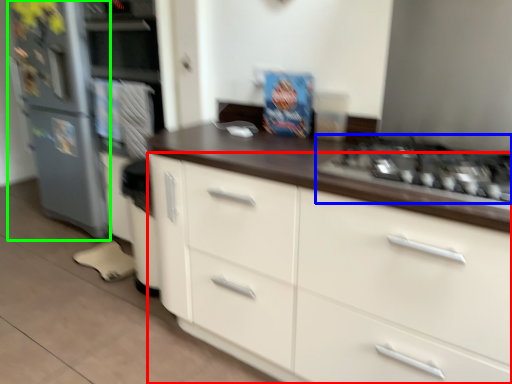
Question: Which is nearer to the cabinetry (highlighted by a red box)? gas stove (highlighted by a blue box) or refrigerator (highlighted by a green box).

Choices:
 (A) gas stove
 (B) refrigerator

Answer: (A)